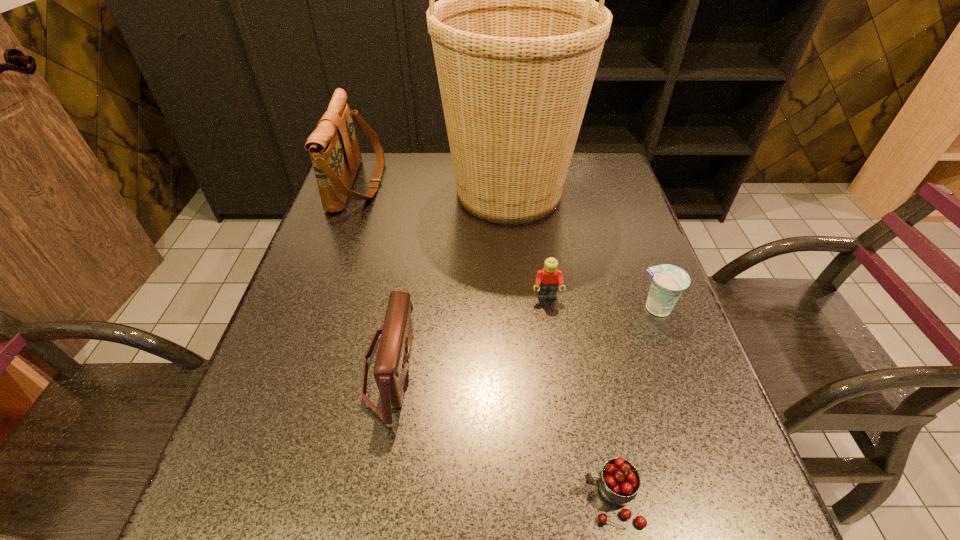
Identify the location of basket that is at the right edge. The image size is (960, 540). (517, 37).

Locate an element on the screen. Image resolution: width=960 pixels, height=540 pixels. yogurt located at the right edge is located at coordinates (668, 282).

Where is `object positioned at the far left corner`? Image resolution: width=960 pixels, height=540 pixels. object positioned at the far left corner is located at coordinates (333, 146).

This screenshot has width=960, height=540. In order to click on object that is at the far right corner in this screenshot , I will do `click(517, 37)`.

The image size is (960, 540). What are the coordinates of `vacant region at the far edge of the desktop` in the screenshot? It's located at (570, 191).

You are a GUI agent. You are given a task and a screenshot of the screen. Output one action in this format:
    pyautogui.click(x=<x>, y=<y>)
    Task: Click on the vacant space at the near edge of the desktop
    Image resolution: width=960 pixels, height=540 pixels.
    Given the screenshot: What is the action you would take?
    pyautogui.click(x=392, y=507)

Locate an element on the screen. The image size is (960, 540). free location at the left edge of the desktop is located at coordinates (288, 341).

Locate an element on the screen. The image size is (960, 540). vacant area at the right edge of the desktop is located at coordinates (588, 245).

Image resolution: width=960 pixels, height=540 pixels. Find the location of `vacant space at the far right corner`. vacant space at the far right corner is located at coordinates (624, 181).

At what (x,y) coordinates should I click in order to perform the action: click on free area in between the tallest object and the cherry. Please return your answer as a coordinate pair (x, y). Image resolution: width=960 pixels, height=540 pixels. Looking at the image, I should click on (561, 345).